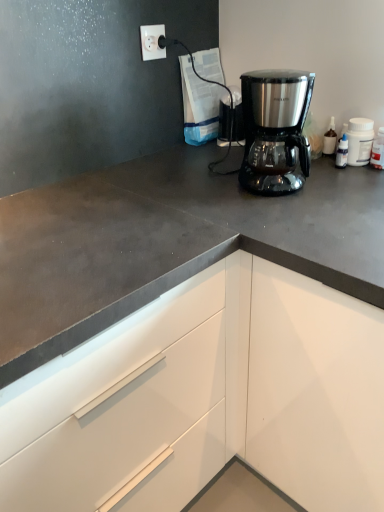
Question: Does stainless steel coffee maker at center have a lesser width compared to white plastic socket at upper left?

Choices:
 (A) no
 (B) yes

Answer: (A)

Question: Is stainless steel coffee maker at center touching white plastic socket at upper left?

Choices:
 (A) no
 (B) yes

Answer: (A)

Question: From the image's perspective, is stainless steel coffee maker at center under white plastic socket at upper left?

Choices:
 (A) no
 (B) yes

Answer: (B)

Question: Considering the relative sizes of stainless steel coffee maker at center and white plastic socket at upper left in the image provided, is stainless steel coffee maker at center shorter than white plastic socket at upper left?

Choices:
 (A) yes
 (B) no

Answer: (B)

Question: Is stainless steel coffee maker at center taller than white plastic socket at upper left?

Choices:
 (A) no
 (B) yes

Answer: (B)

Question: Is stainless steel coffee maker at center facing towards white plastic socket at upper left?

Choices:
 (A) no
 (B) yes

Answer: (A)

Question: Is white plastic bottle at upper right to the right of white plastic socket at upper left from the viewer's perspective?

Choices:
 (A) no
 (B) yes

Answer: (B)

Question: Considering the relative sizes of white plastic bottle at upper right and white plastic socket at upper left in the image provided, is white plastic bottle at upper right bigger than white plastic socket at upper left?

Choices:
 (A) yes
 (B) no

Answer: (A)

Question: Is the position of white plastic bottle at upper right more distant than that of white plastic socket at upper left?

Choices:
 (A) yes
 (B) no

Answer: (B)

Question: Is white plastic bottle at upper right positioned in front of white plastic socket at upper left?

Choices:
 (A) yes
 (B) no

Answer: (A)

Question: Does white plastic bottle at upper right have a smaller size compared to white plastic socket at upper left?

Choices:
 (A) no
 (B) yes

Answer: (A)

Question: Is white plastic bottle at upper right oriented away from white plastic socket at upper left?

Choices:
 (A) yes
 (B) no

Answer: (B)

Question: Does white plastic socket at upper left appear on the left side of stainless steel coffee maker at center?

Choices:
 (A) no
 (B) yes

Answer: (B)